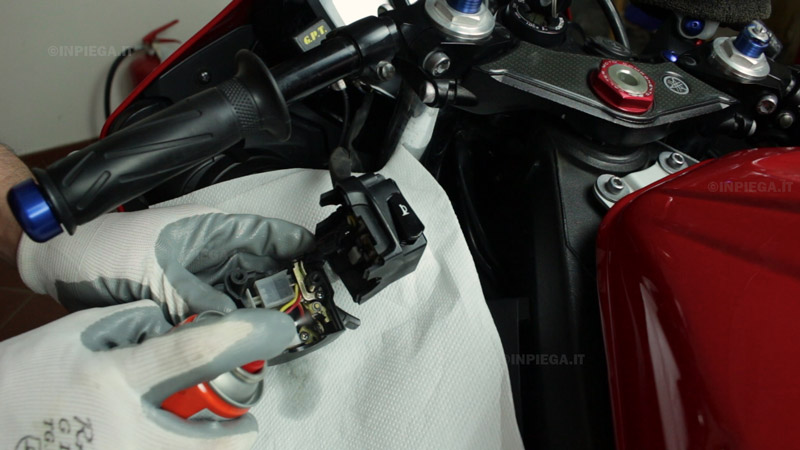
In order to click on white paper towel in this screenshot , I will do `click(446, 358)`.